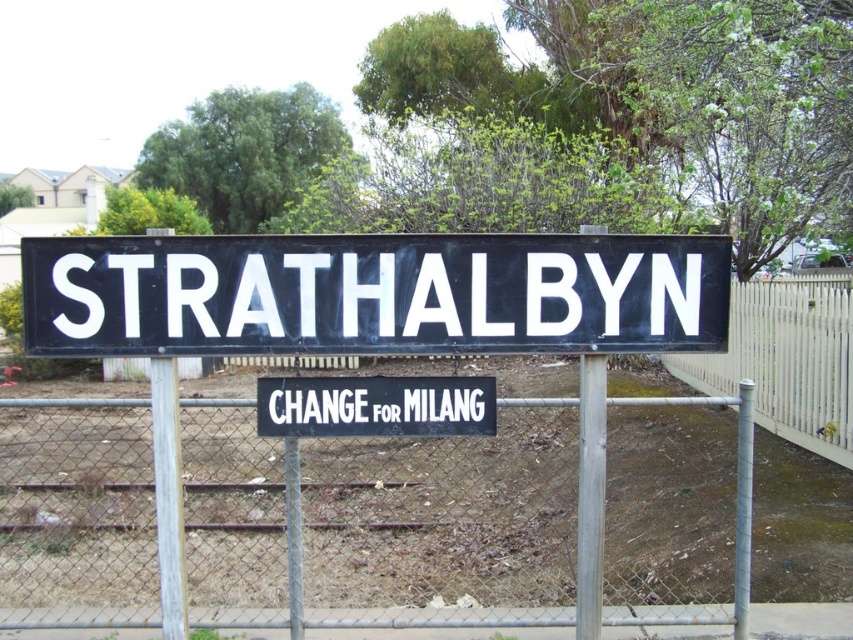
Does point (737, 506) lie behind point (297, 602)?

Yes.

Does silver metallic pole at right have a larger size compared to metallic chain-link fence at lower center?

Indeed, silver metallic pole at right has a larger size compared to metallic chain-link fence at lower center.

Is point (737, 579) farther from camera compared to point (286, 467)?

Yes, it is.

Where is `silver metallic pole at right`? This screenshot has height=640, width=853. silver metallic pole at right is located at coordinates (743, 508).

How much distance is there between black matte sign at center and silver metallic pole at right?

The distance of black matte sign at center from silver metallic pole at right is 5.30 feet.

Who is more distant from viewer, (x=582, y=300) or (x=741, y=577)?

The point (x=741, y=577) is more distant.

Where is `black matte sign at center`? Image resolution: width=853 pixels, height=640 pixels. black matte sign at center is located at coordinates (373, 292).

Between silver metallic pole at center and silver metallic pole at right, which one has less height?

Standing shorter between the two is silver metallic pole at right.

Is point (601, 556) less distant than point (749, 481)?

Yes, it is in front of point (749, 481).

The image size is (853, 640). Find the location of `silver metallic pole at center`. silver metallic pole at center is located at coordinates (590, 493).